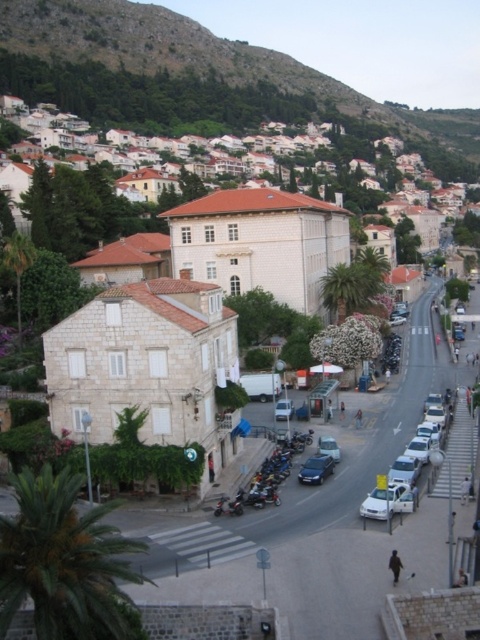
You are navigating a delivery drone along a route in the urban scene. Your path takes you from point A to point B. If point A is at coordinates point (66, 298) and point B is at point (363, 499), which point is closer to the viewer?

Point (363, 499) is closer to the viewer because the Objects Description states that point (66, 298) is behind point (363, 499).

You are standing at the point marked as point (346, 289) in the image. What object is located exactly at that point?

The green leafy palm tree at center is located exactly at point (346, 289).